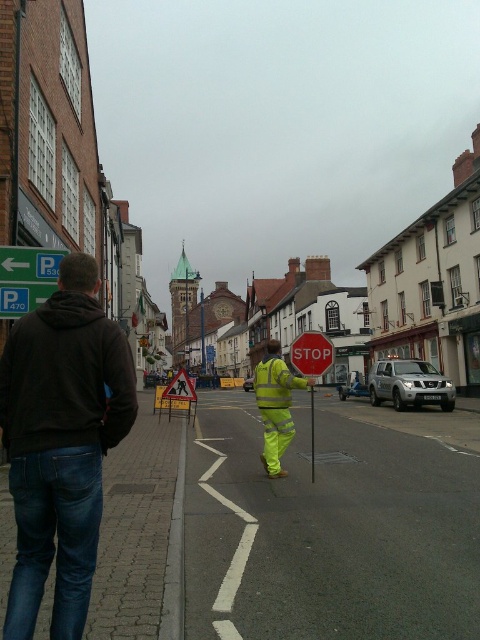
You are a delivery driver who needs to navigate through the town center shown in the image. There is a point marked at coordinates (276, 404) on the image. What object is located at this point?

The point at coordinates (276, 404) indicates the location of the high visibility yellow jacket at center.